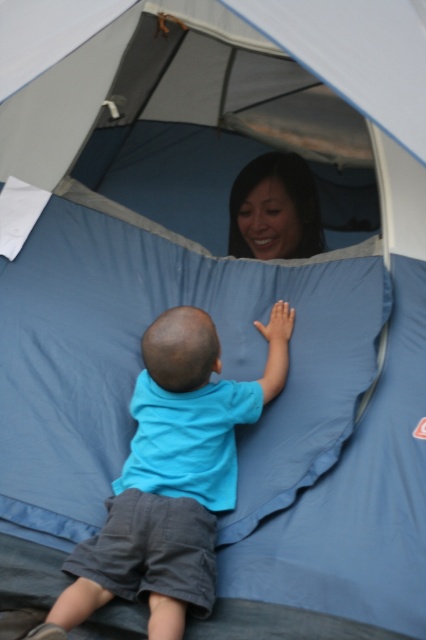
Does blue cotton shirt at center have a larger size compared to smooth skin face at upper center?

Correct, blue cotton shirt at center is larger in size than smooth skin face at upper center.

Who is more forward, (212, 426) or (282, 220)?

Point (212, 426) is more forward.

Find the location of a particular element. The width and height of the screenshot is (426, 640). blue cotton shirt at center is located at coordinates coord(158,419).